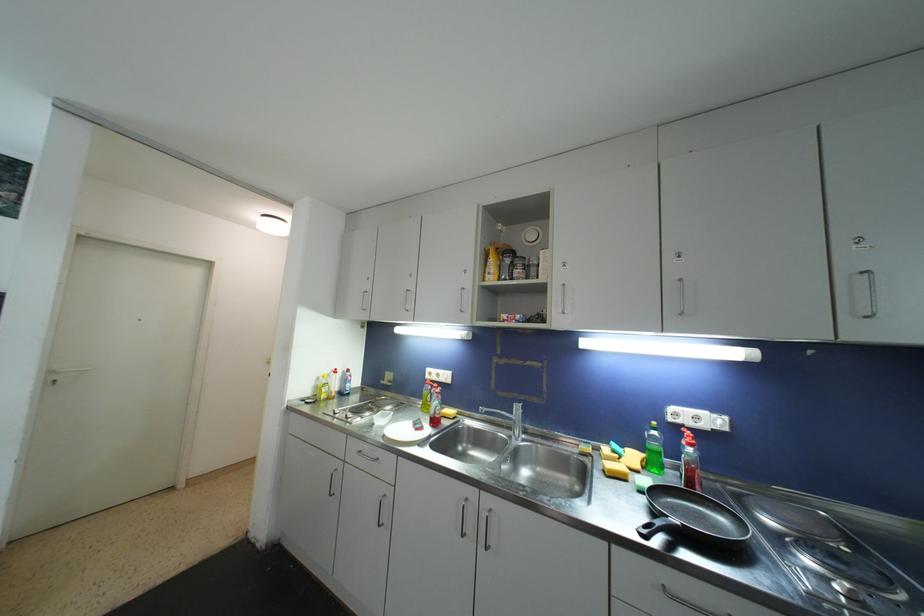
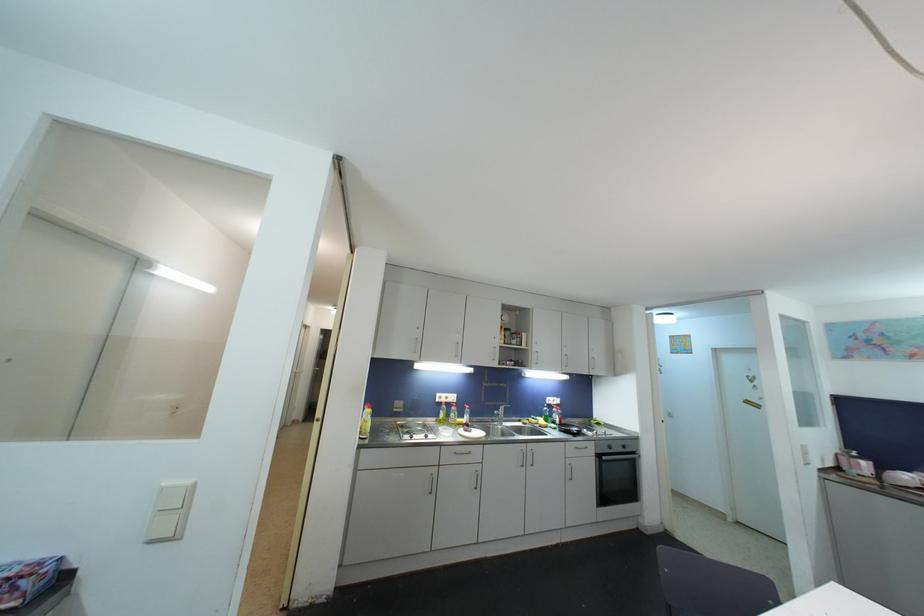
Find the pixel in the second image that matches pixel 441 378 in the first image.

(450, 400)